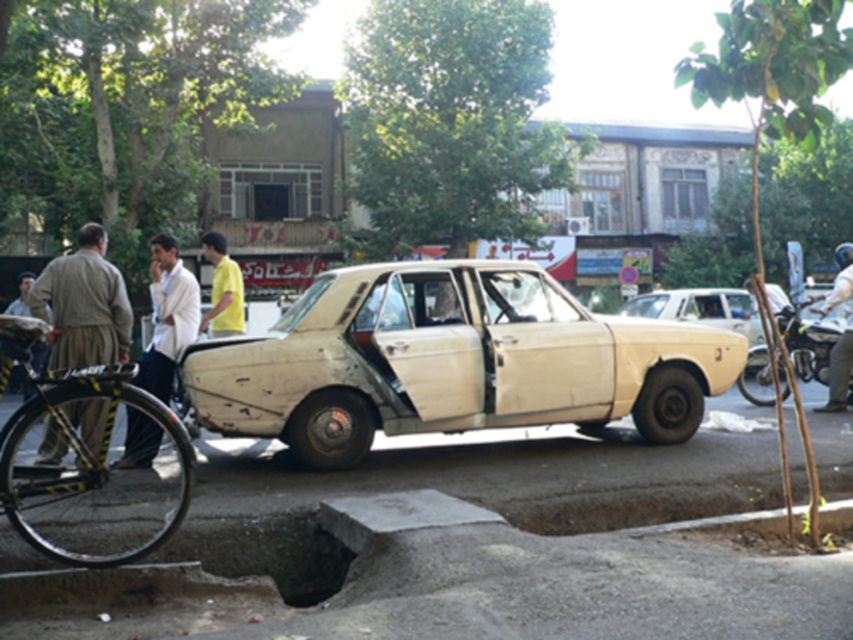
You are a pedestrian standing at the curb where the black bicycle with yellow and black striped tape is leaning. You want to walk to the khaki fabric pants at left. Is the white matte car at center blocking your path?

The white matte car at center is below the khaki fabric pants at left, so it is positioned lower in the image. Since you are at the curb near the bicycle, the car might be in your way depending on its actual position. However, based on the description, the car is at the center and below the pants, suggesting it is closer to the ground or lower in the frame. Therefore, it may not block your path if you walk around it or over the curb.

You are a delivery person trying to park your bike near the damaged beige sedan. The bike must be placed exactly where the white clothed man at center is standing. Can you park your black bicycle with yellow and black striped tape wrapped around its frame there without blocking the pedestrian path?

The white clothed man at center is located at point (167, 316), so yes, you can park the black bicycle with yellow and black striped tape wrapped around its frame there as it won not block the pedestrian path since the man is at that specific coordinate.

You are a pedestrian standing on the sidewalk and see the white clothed man at center and the light beige shirt at center. Which one is lower in position?

The white clothed man at center is located below light beige shirt at center, so the white clothed man at center is lower in position.